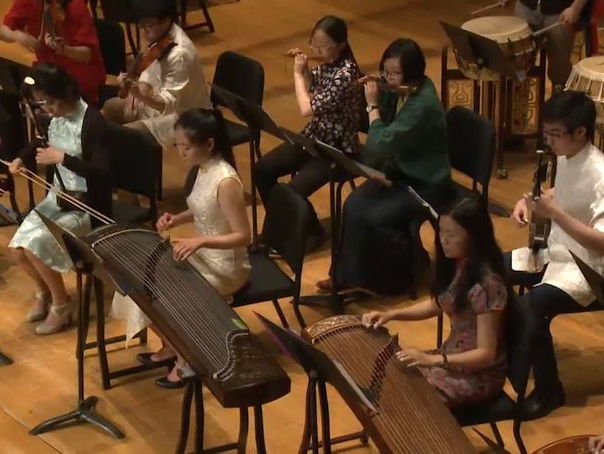
You are a GUI agent. You are given a task and a screenshot of the screen. Output one action in this format:
    pyautogui.click(x=<x>, y=<y>)
    Task: Click on the chair
    
    Given the screenshot: What is the action you would take?
    pyautogui.click(x=259, y=276), pyautogui.click(x=505, y=419), pyautogui.click(x=457, y=185), pyautogui.click(x=138, y=205), pyautogui.click(x=239, y=139)